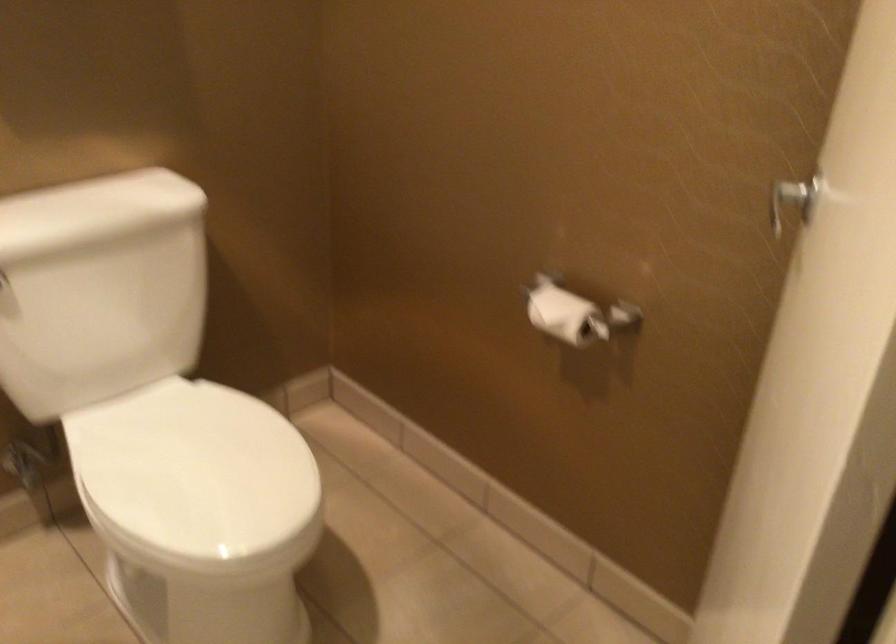
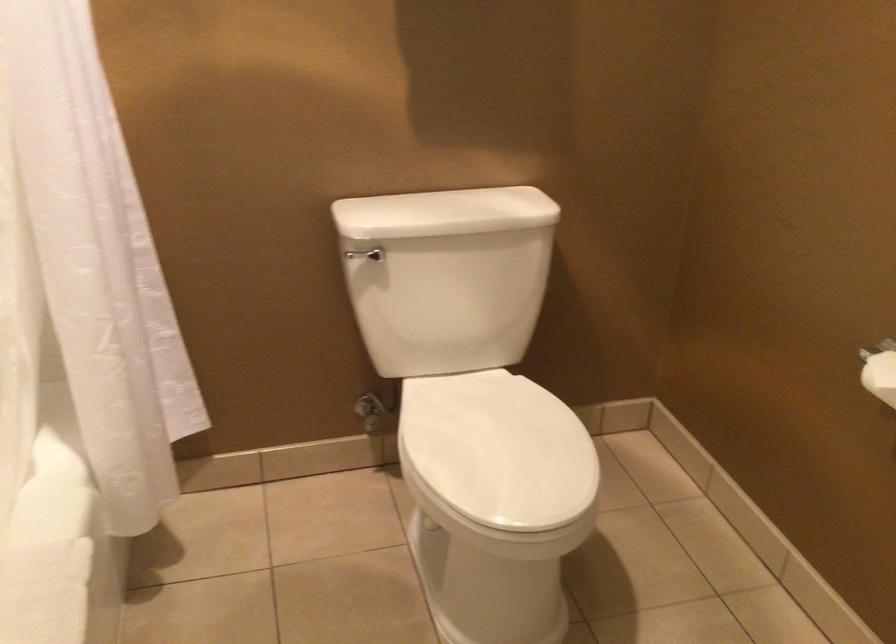
Locate, in the second image, the point that corresponds to (x=545, y=312) in the first image.

(880, 375)